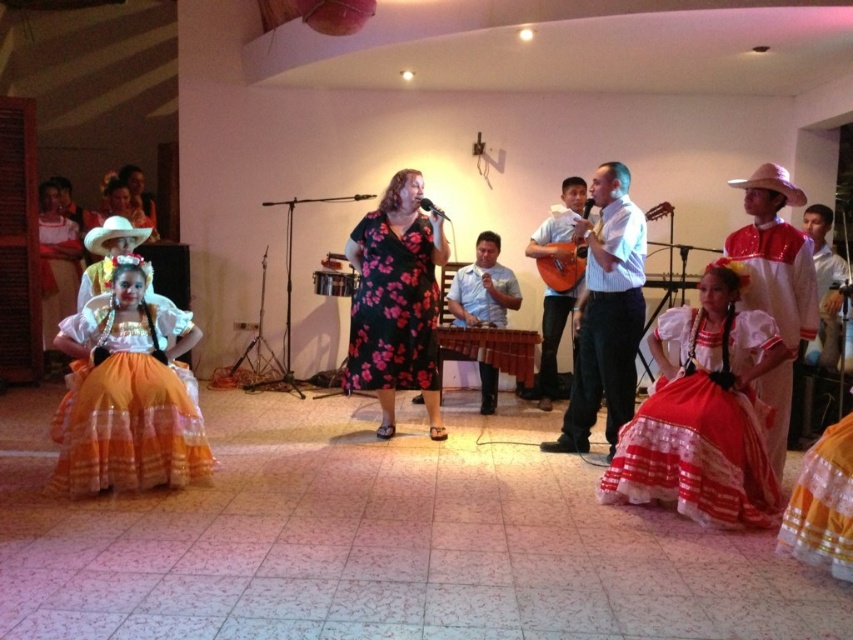
Is the position of matte orange guitar at center more distant than that of white cotton shirt at center?

Yes, it is behind white cotton shirt at center.

Based on the photo, which is above, matte orange guitar at center or white cotton shirt at center?

white cotton shirt at center is higher up.

Does point (550, 257) lie in front of point (824, 268)?

No, it is behind (824, 268).

The height and width of the screenshot is (640, 853). I want to click on matte orange guitar at center, so click(x=552, y=301).

Which is above, light blue shirt at center or orange satin dress at lower left?

orange satin dress at lower left

Between light blue shirt at center and orange satin dress at lower left, which one has less height?

light blue shirt at center

Consider the image. Measure the distance between light blue shirt at center and camera.

light blue shirt at center is 18.03 feet away from camera.

The image size is (853, 640). Find the location of `light blue shirt at center`. light blue shirt at center is located at coordinates (483, 288).

Is red satin dress at lower right above white shirt at center?

Actually, red satin dress at lower right is below white shirt at center.

What do you see at coordinates (701, 426) in the screenshot?
I see `red satin dress at lower right` at bounding box center [701, 426].

Image resolution: width=853 pixels, height=640 pixels. Identify the location of red satin dress at lower right. (701, 426).